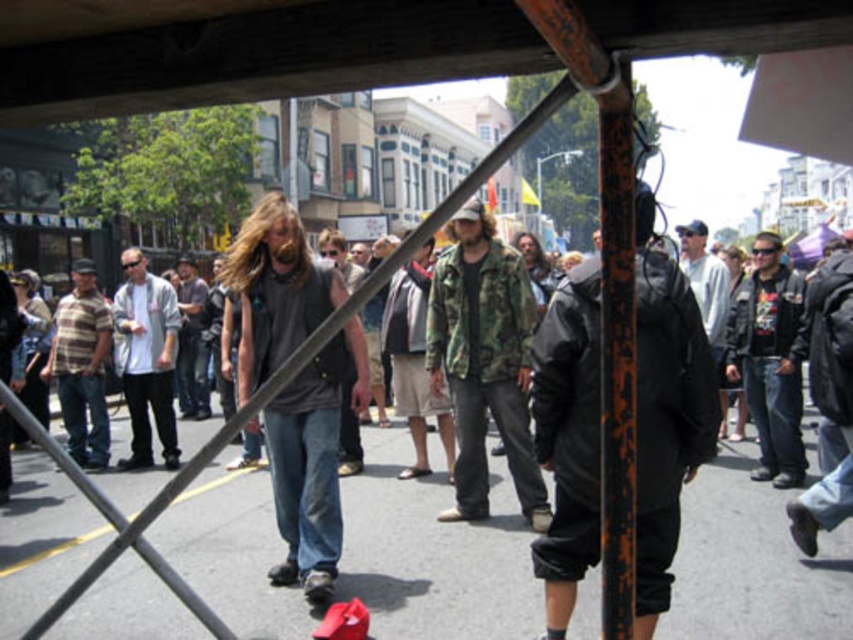
Question: Is dark gray fabric shirt at center wider than white cotton shirt at left?

Choices:
 (A) no
 (B) yes

Answer: (B)

Question: Estimate the real-world distances between objects in this image. Which object is farther from the dark gray fabric shirt at center?

Choices:
 (A) dark gray shirt at center
 (B) white cotton shirt at left

Answer: (A)

Question: Based on their relative distances, which object is nearer to the dark brown leather jacket at center?

Choices:
 (A) dark gray shirt at center
 (B) black matte jumpsuit at center
 (C) camouflage jacket at center
 (D) striped cotton shirt at left

Answer: (C)

Question: Does gray asphalt pavement at lower center appear under camouflage jacket at center?

Choices:
 (A) yes
 (B) no

Answer: (A)

Question: Among these objects, which one is nearest to the camera?

Choices:
 (A) striped cotton shirt at left
 (B) black leather jacket at center

Answer: (B)

Question: Does camouflage jacket at center come behind dark gray shirt at center?

Choices:
 (A) yes
 (B) no

Answer: (B)